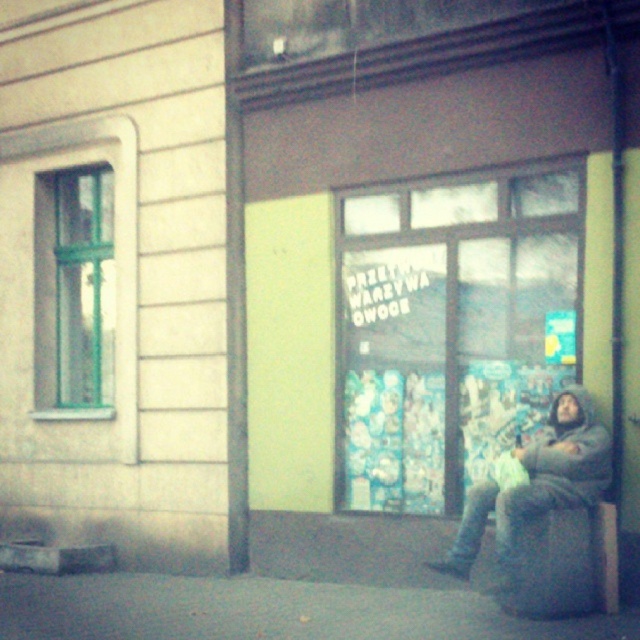
Can you confirm if fuzzy gray coat at lower right is shorter than gray fabric stool at lower right?

No.

Is point (572, 426) positioned before point (532, 576)?

No, (572, 426) is behind (532, 576).

Where is `fuzzy gray coat at lower right`? This screenshot has width=640, height=640. fuzzy gray coat at lower right is located at coordinates (536, 484).